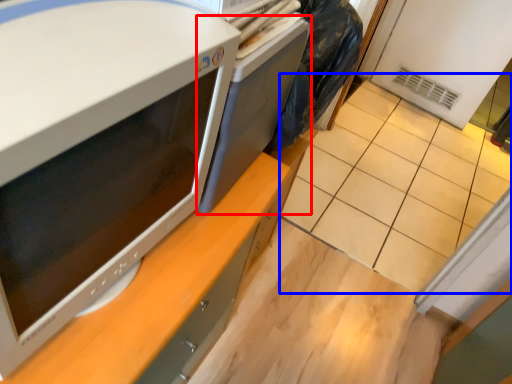
Question: Which of the following is the farthest to the observer, desktop (highlighted by a red box) or tile (highlighted by a blue box)?

Choices:
 (A) desktop
 (B) tile

Answer: (B)